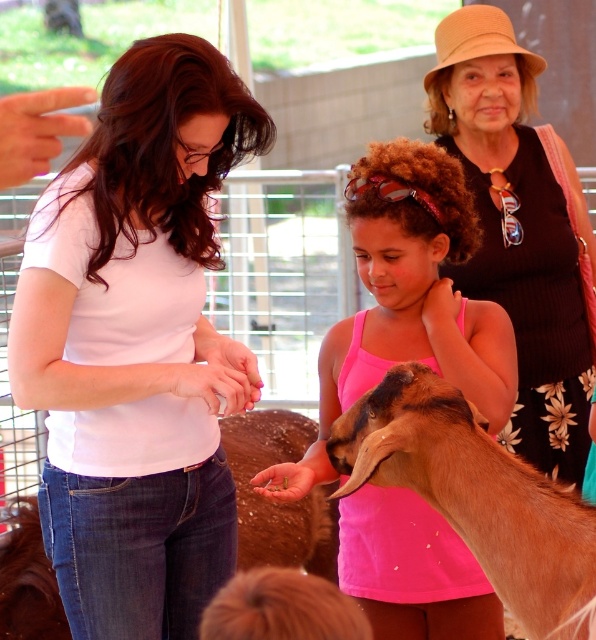
Question: Which object appears farthest from the camera in this image?

Choices:
 (A) black ribbed tank top at upper right
 (B) brown fuzzy goat at lower center
 (C) brown fuzzy goat at center

Answer: (B)

Question: Estimate the real-world distances between objects in this image. Which object is closer to the white matte shirt at center?

Choices:
 (A) black ribbed tank top at upper right
 (B) pink fabric tank top at center

Answer: (B)

Question: Can you confirm if white matte shirt at center is positioned above brown fuzzy goat at lower center?

Choices:
 (A) yes
 (B) no

Answer: (A)

Question: Does pink fabric tank top at center appear over black ribbed tank top at upper right?

Choices:
 (A) yes
 (B) no

Answer: (B)

Question: Which point is farther to the camera?

Choices:
 (A) (429, 438)
 (B) (418, 145)

Answer: (B)

Question: Does white matte shirt at center have a lesser width compared to brown fuzzy goat at lower center?

Choices:
 (A) no
 (B) yes

Answer: (A)